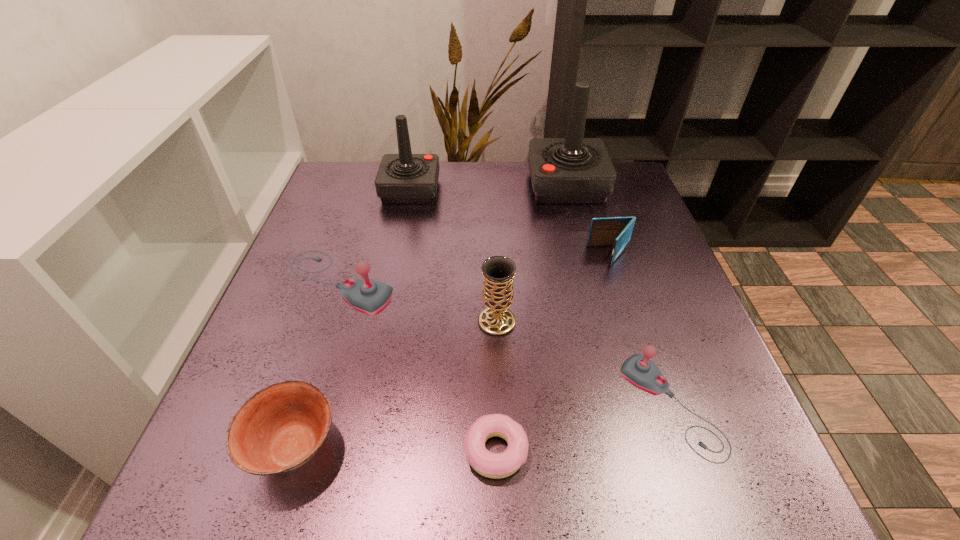
Locate an element on the screen. This screenshot has height=540, width=960. object present at the far left corner is located at coordinates (405, 178).

The image size is (960, 540). What are the coordinates of `object positioned at the near left corner` in the screenshot? It's located at (279, 428).

The width and height of the screenshot is (960, 540). What are the coordinates of `object at the far right corner` in the screenshot? It's located at (574, 170).

Where is `object located in the near right corner section of the desktop`? object located in the near right corner section of the desktop is located at coordinates (638, 370).

Image resolution: width=960 pixels, height=540 pixels. In order to click on vacant space at the far edge of the desktop in this screenshot , I will do `click(516, 192)`.

At what (x,y) coordinates should I click in order to perform the action: click on vacant space at the left edge of the desktop. Please return your answer as a coordinate pair (x, y). Looking at the image, I should click on (298, 302).

The image size is (960, 540). In order to click on blank space at the right edge of the desktop in this screenshot , I will do `click(596, 248)`.

Where is `vacant space at the near left corner`? This screenshot has height=540, width=960. vacant space at the near left corner is located at coordinates (213, 455).

Locate an element on the screen. This screenshot has width=960, height=540. free space at the near right corner of the desktop is located at coordinates (713, 490).

You are a GUI agent. You are given a task and a screenshot of the screen. Output one action in this format:
    pyautogui.click(x=<x>, y=<y>)
    Task: Click on the vacant space that's between the wallet and the shortest joystick
    
    Given the screenshot: What is the action you would take?
    pyautogui.click(x=640, y=331)